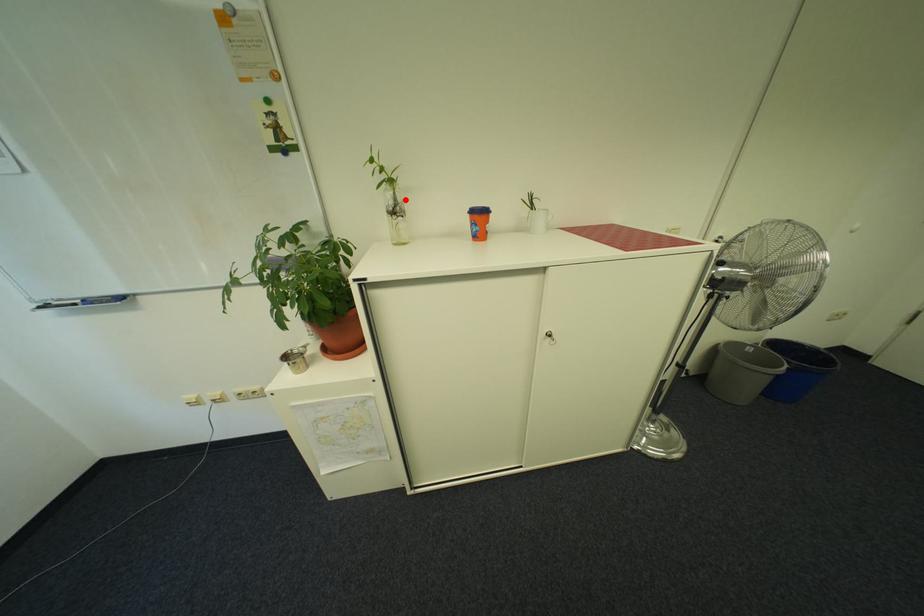
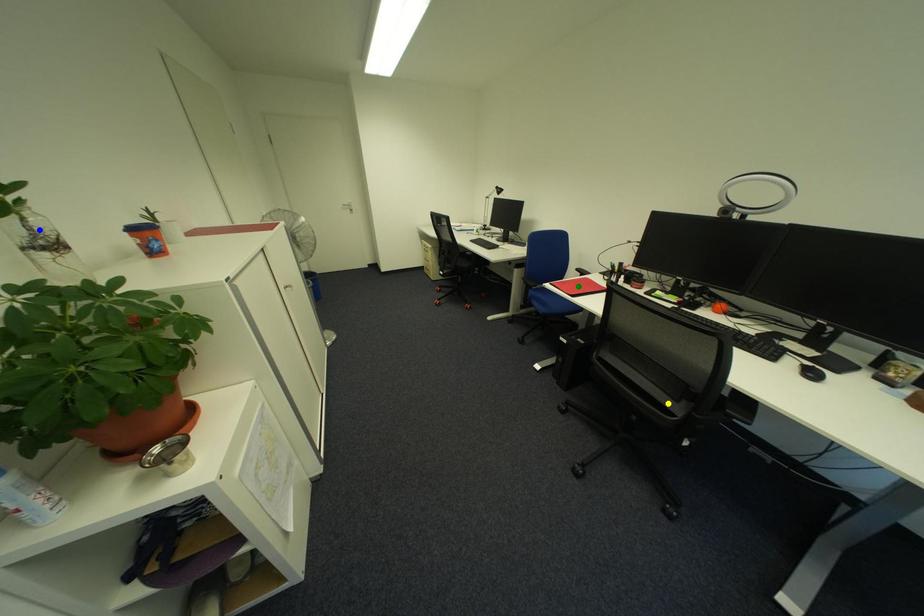
Question: I am providing you with two images of the same scene from different viewpoints. A red point is marked on the first image. You are given multiple points on the second image. Which mark in image 2 goes with the point in image 1?

Choices:
 (A) blue point
 (B) yellow point
 (C) green point

Answer: (A)